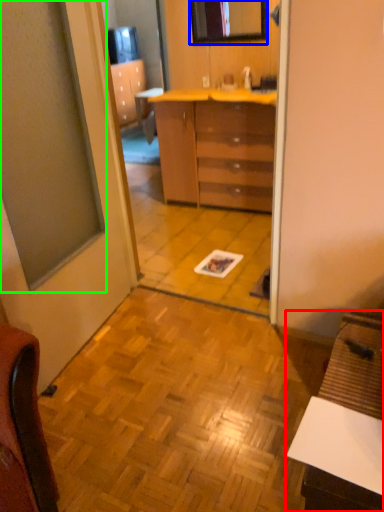
Question: Estimate the real-world distances between objects in this image. Which object is farther from desk (highlighted by a red box), mirror (highlighted by a blue box) or window (highlighted by a green box)?

Choices:
 (A) mirror
 (B) window

Answer: (A)